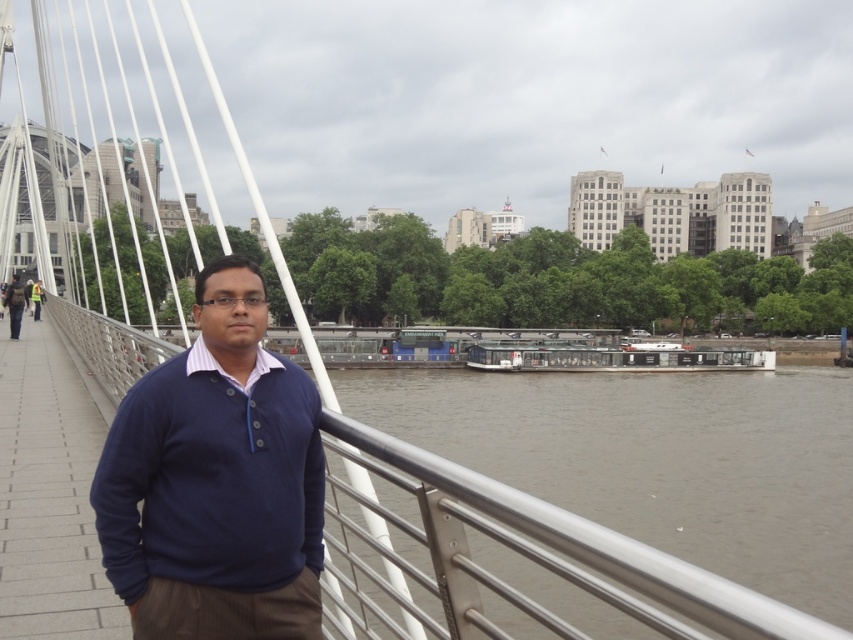
Is point (142, 454) closer to viewer compared to point (38, 310)?

Yes, point (142, 454) is in front of point (38, 310).

Is point (105, 545) positioned behind point (38, 280)?

No, it is in front of (38, 280).

This screenshot has height=640, width=853. Identify the location of navy blue sweater at center. (216, 481).

Is navy blue sweater at center further to the viewer compared to white glossy boat at center?

No, it is in front of white glossy boat at center.

In the scene shown: Does navy blue sweater at center lie in front of white glossy boat at center?

Yes, it is.

Is point (256, 397) in front of point (479, 362)?

Yes, point (256, 397) is in front of point (479, 362).

At what (x,y) coordinates should I click in order to perform the action: click on navy blue sweater at center. Please return your answer as a coordinate pair (x, y). This screenshot has width=853, height=640. Looking at the image, I should click on (216, 481).

Does navy blue sweater at center lie behind matte black backpack at left?

No, it is in front of matte black backpack at left.

Between navy blue sweater at center and matte black backpack at left, which one has more height?

Standing taller between the two is navy blue sweater at center.

Is point (218, 509) closer to camera compared to point (4, 307)?

That is True.

What are the coordinates of `navy blue sweater at center` in the screenshot? It's located at (216, 481).